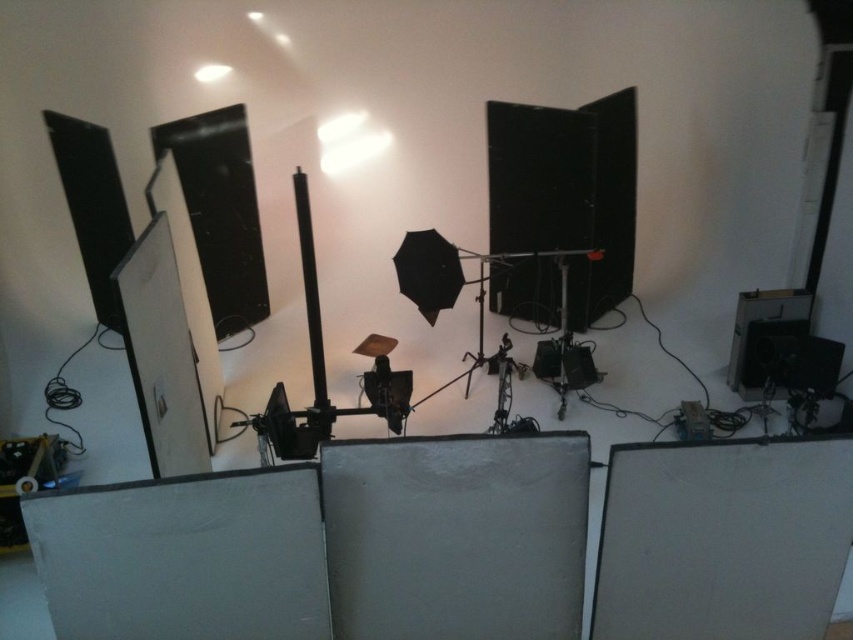
Question: Can you confirm if matte black speaker at upper left is positioned above black plastic speaker at lower right?

Choices:
 (A) yes
 (B) no

Answer: (A)

Question: Which object is farther from the camera taking this photo?

Choices:
 (A) black plastic speaker at lower right
 (B) matte black speaker at upper left

Answer: (B)

Question: In this image, where is matte black speaker at upper left located relative to black plastic speaker at lower right?

Choices:
 (A) below
 (B) above

Answer: (B)

Question: Observing the image, what is the correct spatial positioning of matte black speaker at upper left in reference to black plastic speaker at lower right?

Choices:
 (A) above
 (B) below

Answer: (A)